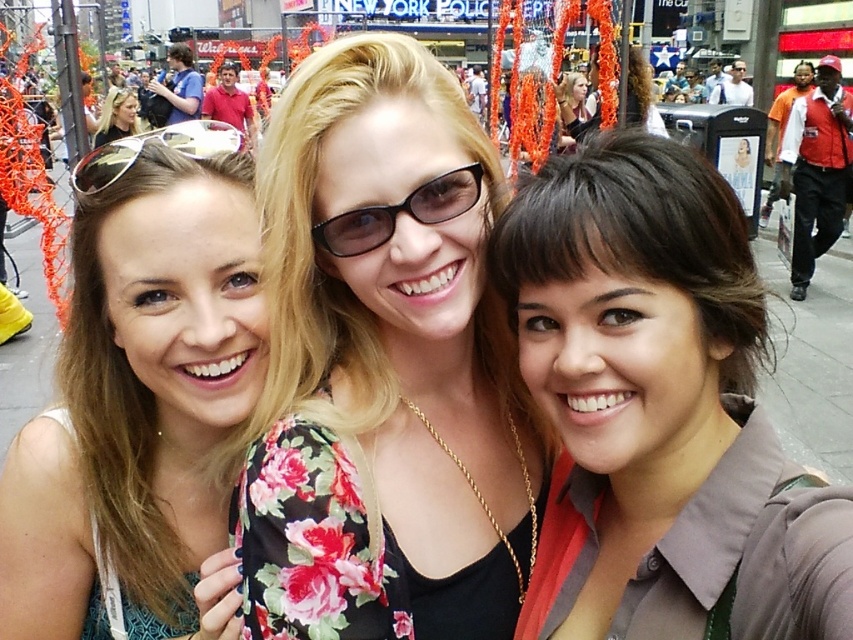
Between floral fabric blouse at center and matte black sunglasses at upper center, which one is positioned lower?

floral fabric blouse at center is below.

Find the location of `floral fabric blouse at center`. floral fabric blouse at center is located at coordinates (384, 365).

This screenshot has height=640, width=853. What do you see at coordinates (384, 365) in the screenshot?
I see `floral fabric blouse at center` at bounding box center [384, 365].

Locate an element on the screen. This screenshot has width=853, height=640. floral fabric blouse at center is located at coordinates (384, 365).

Is brown hair at center positioned at the back of matte black sunglasses at upper center?

No.

Does brown hair at center appear under matte black sunglasses at upper center?

Correct, brown hair at center is located below matte black sunglasses at upper center.

Where is `brown hair at center`? The height and width of the screenshot is (640, 853). brown hair at center is located at coordinates (660, 410).

The image size is (853, 640). I want to click on brown hair at center, so click(x=660, y=410).

Does silver reflective sunglasses at upper left have a smaller size compared to matte black sunglasses at upper center?

No, silver reflective sunglasses at upper left is not smaller than matte black sunglasses at upper center.

Which is below, silver reflective sunglasses at upper left or matte black sunglasses at upper center?

silver reflective sunglasses at upper left is below.

Which is behind, point (190, 124) or point (564, 81)?

The point (564, 81) is more distant.

At what (x,y) coordinates should I click in order to perform the action: click on silver reflective sunglasses at upper left. Please return your answer as a coordinate pair (x, y). Looking at the image, I should click on (158, 141).